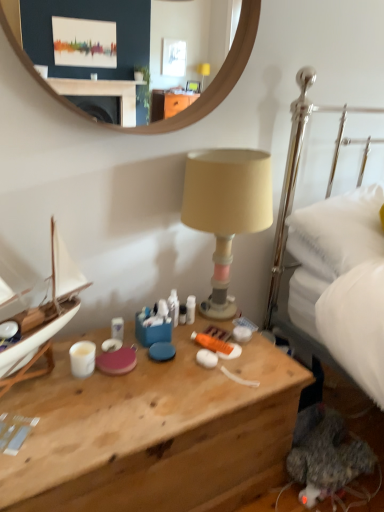
Locate an element on the screen. The width and height of the screenshot is (384, 512). free location in front of white plastic tube at center is located at coordinates (186, 348).